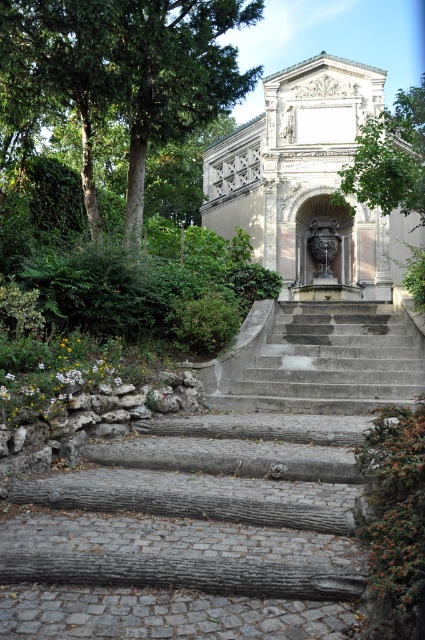
Between point (295, 172) and point (368, 385), which one is positioned behind?

Point (295, 172)

Is stone fountain at center to the left of gray concrete stairs at center from the viewer's perspective?

In fact, stone fountain at center is to the right of gray concrete stairs at center.

Locate an element on the screen. stone fountain at center is located at coordinates (306, 177).

Describe the element at coordinates (329, 362) in the screenshot. I see `gray concrete stairs at center` at that location.

Is gray concrete stairs at center taller than green leafy tree at center?

No, gray concrete stairs at center is not taller than green leafy tree at center.

Does point (337, 365) come behind point (376, 122)?

No, (337, 365) is closer to viewer.

Identify the location of gray concrete stairs at center. The width and height of the screenshot is (425, 640). (329, 362).

Which is more to the left, green leafy tree at upper left or gray concrete stairs at center?

Positioned to the left is green leafy tree at upper left.

Is point (238, 74) positioned before point (246, 396)?

No, it is not.

The height and width of the screenshot is (640, 425). What do you see at coordinates (124, 72) in the screenshot?
I see `green leafy tree at upper left` at bounding box center [124, 72].

At what (x,y) coordinates should I click in order to perform the action: click on green leafy tree at upper left. Please return your answer as a coordinate pair (x, y). The image size is (425, 640). Looking at the image, I should click on (124, 72).